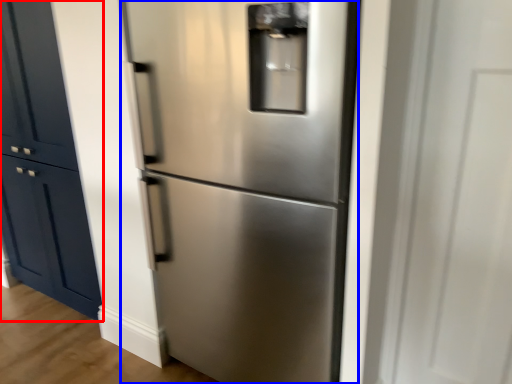
Question: Among these objects, which one is farthest to the camera, door (highlighted by a red box) or refrigerator (highlighted by a blue box)?

Choices:
 (A) door
 (B) refrigerator

Answer: (A)